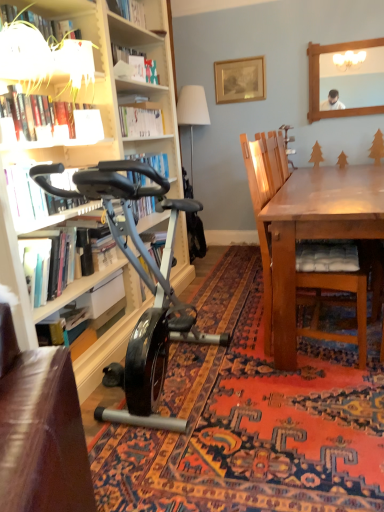
Locate an element on the screen. The width and height of the screenshot is (384, 512). free spot above wooden frame at upper right (from a real-world perspective) is located at coordinates (351, 34).